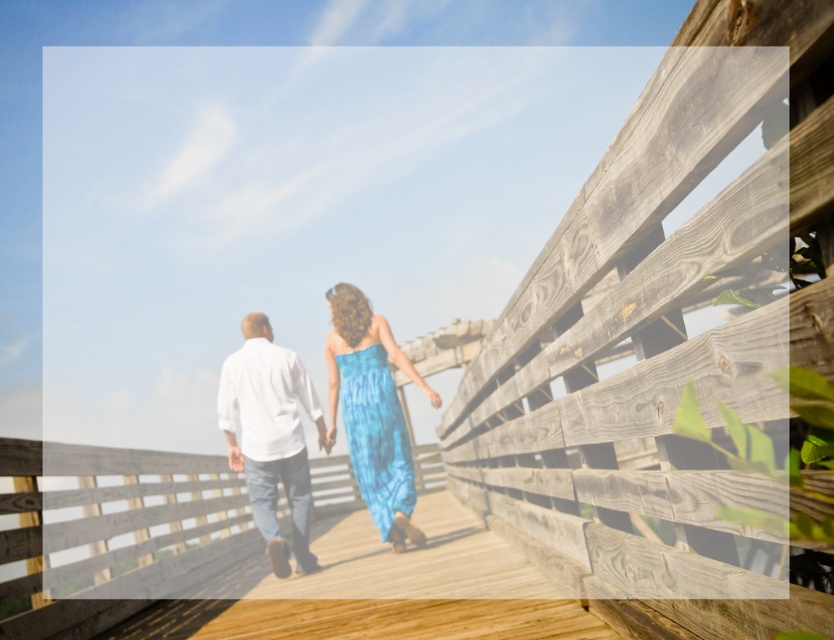
You are a photographer standing at the camera position. You want to take a photo of the white cotton shirt at center. Where should you aim your camera to capture it?

A: You should aim your camera at point (270, 435) to capture the white cotton shirt at center.